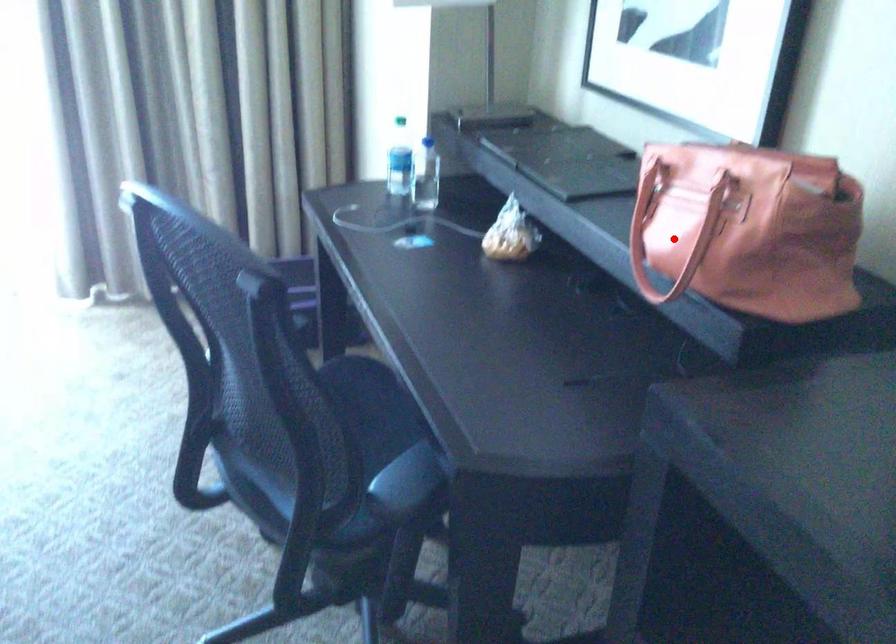
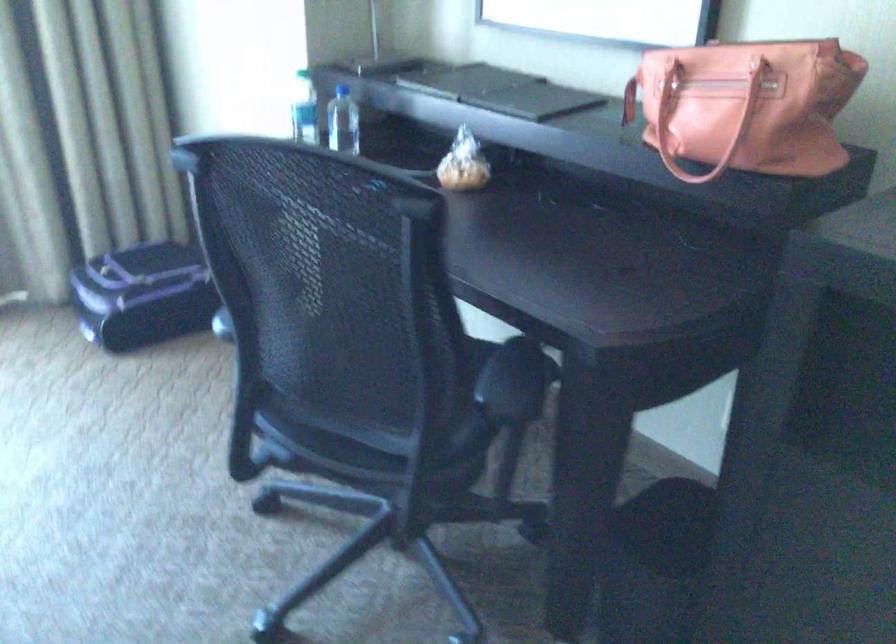
In the second image, find the point that corresponds to the highlighted location in the first image.

(704, 122)